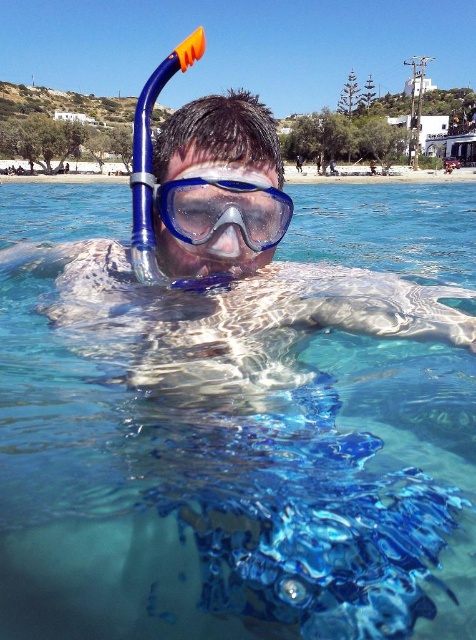
Measure the distance between clear blue water at center and camera.

They are 7.67 feet apart.

Between clear blue water at center and blue matte/glossy goggles at center, which one has more height?

Standing taller between the two is clear blue water at center.

Is point (128, 342) closer to viewer compared to point (228, 195)?

No, it is not.

The width and height of the screenshot is (476, 640). Find the location of `clear blue water at center`. clear blue water at center is located at coordinates pyautogui.click(x=239, y=428).